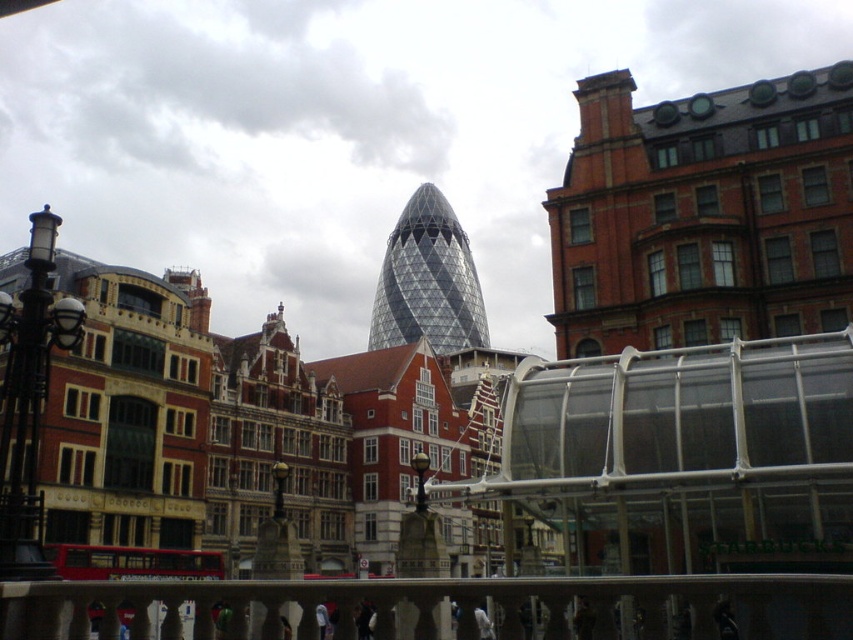
Between point (821, 586) and point (461, 332), which one is positioned in front?

Positioned in front is point (821, 586).

Does white marble railing at center appear under transparent glass tower at center?

Yes, white marble railing at center is below transparent glass tower at center.

Describe the element at coordinates (430, 604) in the screenshot. I see `white marble railing at center` at that location.

Where is `white marble railing at center`? The image size is (853, 640). white marble railing at center is located at coordinates (430, 604).